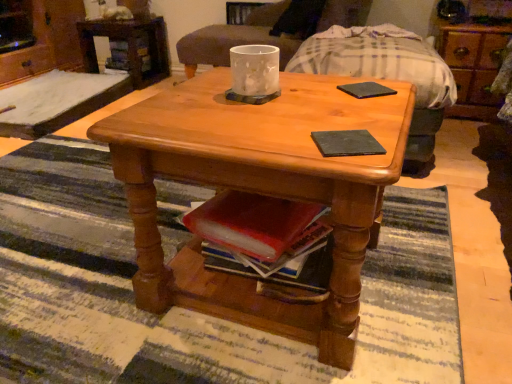
The width and height of the screenshot is (512, 384). I want to click on free space on the front side of black matte pad at center, which is the second pad from front to back, so click(x=365, y=110).